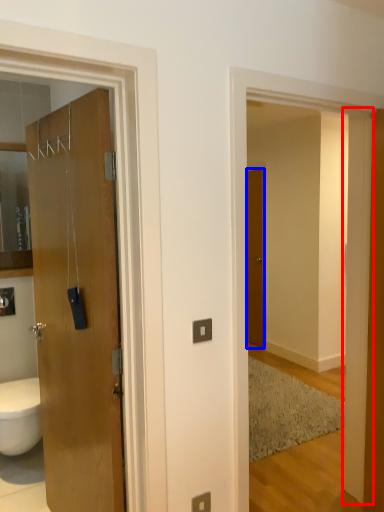
Question: Which object is further to the camera taking this photo, pillar (highlighted by a red box) or door (highlighted by a blue box)?

Choices:
 (A) pillar
 (B) door

Answer: (B)